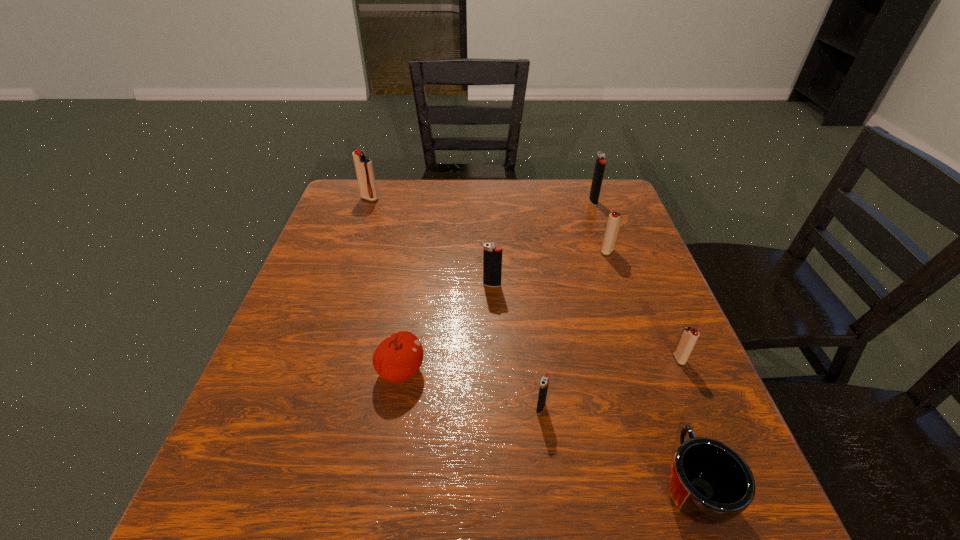
The width and height of the screenshot is (960, 540). What are the coordinates of `object at the far right corner` in the screenshot? It's located at (600, 163).

Image resolution: width=960 pixels, height=540 pixels. I want to click on object situated at the near right corner, so click(x=709, y=483).

In the image, there is a desktop. Where is `vacant space at the far edge`? The width and height of the screenshot is (960, 540). vacant space at the far edge is located at coordinates (491, 187).

Where is `vacant space at the left edge`? vacant space at the left edge is located at coordinates (363, 252).

At what (x,y) coordinates should I click in order to perform the action: click on blank space at the right edge. Please return your answer as a coordinate pair (x, y). Looking at the image, I should click on (650, 402).

I want to click on vacant space at the far left corner of the desktop, so click(x=353, y=183).

At what (x,y) coordinates should I click in order to perform the action: click on vacant space at the far right corner. Please return your answer as a coordinate pair (x, y). The image size is (960, 540). Looking at the image, I should click on (574, 179).

The image size is (960, 540). Identify the location of free area in between the leftmost object and the red apple. pos(385,285).

Where is `free point between the nearest black igniter and the second object from left to right`? This screenshot has height=540, width=960. free point between the nearest black igniter and the second object from left to right is located at coordinates (471, 389).

You are a GUI agent. You are given a task and a screenshot of the screen. Output one action in this format:
    pyautogui.click(x=<x>, y=<y>)
    Task: Click on the free area in between the third nearest igniter and the second black igniter from right to left
    This screenshot has height=540, width=960.
    Given the screenshot: What is the action you would take?
    pyautogui.click(x=516, y=346)